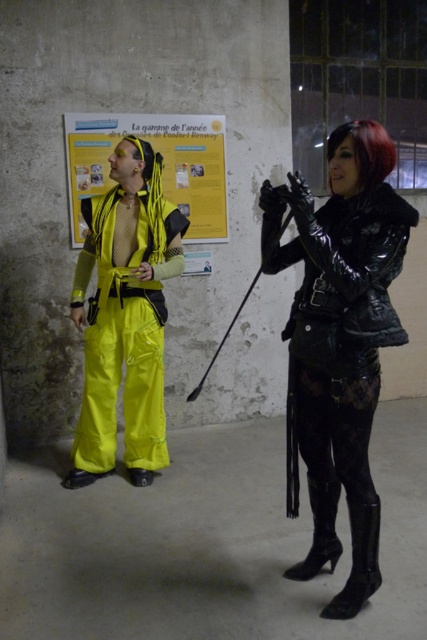
Question: Which object is the farthest from the black patent leather boot at lower right?

Choices:
 (A) black patent leather boot at lower center
 (B) glossy black leather jacket at right
 (C) neon yellow fabric pants at left
 (D) yellow paper poster at upper center

Answer: (D)

Question: Is glossy black leather jacket at right below short red hair at upper right?

Choices:
 (A) no
 (B) yes

Answer: (B)

Question: Does yellow paper poster at upper center come behind short red hair at upper right?

Choices:
 (A) no
 (B) yes

Answer: (B)

Question: Is glossy black leather jacket at right closer to camera compared to black patent leather boot at lower center?

Choices:
 (A) no
 (B) yes

Answer: (B)

Question: Which object is positioned farthest from the short red hair at upper right?

Choices:
 (A) yellow paper poster at upper center
 (B) black patent leather boot at lower right
 (C) black patent leather boot at lower center
 (D) neon yellow fabric pants at left

Answer: (A)

Question: Estimate the real-world distances between objects in this image. Which object is closer to the short red hair at upper right?

Choices:
 (A) black patent leather boot at lower right
 (B) yellow paper poster at upper center

Answer: (A)